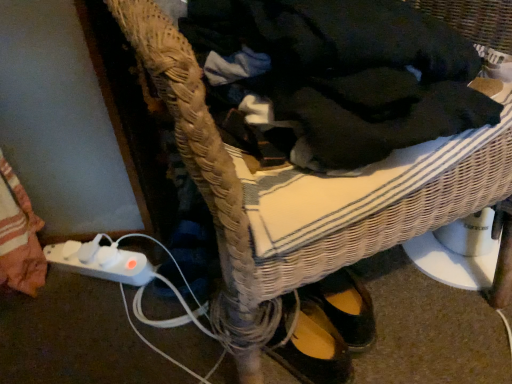
Find the location of a particular element. Image resolution: width=512 pixels, height=384 pixels. free region on the left part of white plastic plug at lower left is located at coordinates (42, 288).